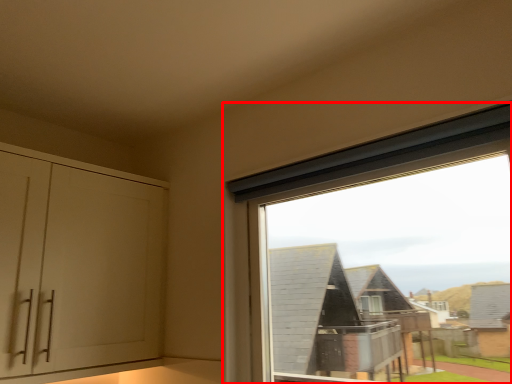
Question: Observing the image, what is the correct spatial positioning of window (annotated by the red box) in reference to cabinetry?

Choices:
 (A) right
 (B) left

Answer: (A)